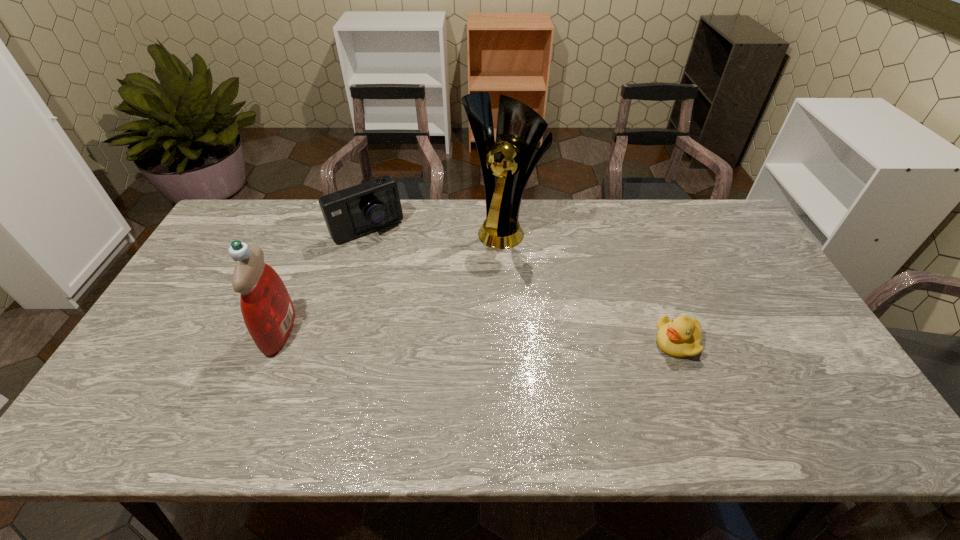
Image resolution: width=960 pixels, height=540 pixels. Identify the location of vacant point located between the third tallest object and the tallest object. (435, 229).

Locate an element on the screen. This screenshot has height=540, width=960. free space between the duckling and the second shortest object is located at coordinates (522, 286).

The width and height of the screenshot is (960, 540). Find the location of `free space between the duckling and the tallest object`. free space between the duckling and the tallest object is located at coordinates (589, 285).

Identify which object is located as the second nearest to the third tallest object. Please provide its 2D coordinates. Your answer should be formatted as a tuple, i.e. [(x, y)], where the tuple contains the x and y coordinates of a point satisfying the conditions above.

[(268, 312)]

Identify the location of the closest object to the shortest object. The width and height of the screenshot is (960, 540). (504, 164).

The width and height of the screenshot is (960, 540). I want to click on vacant position in the image that satisfies the following two spatial constraints: 1. on the front side of the camera; 2. on the front-facing side of the duckling, so click(335, 342).

Where is `free space that satisfies the following two spatial constraints: 1. on the front side of the shortest object; 2. on the front-facing side of the second object from right to left`? The image size is (960, 540). free space that satisfies the following two spatial constraints: 1. on the front side of the shortest object; 2. on the front-facing side of the second object from right to left is located at coordinates (509, 342).

Image resolution: width=960 pixels, height=540 pixels. Identify the location of vacant space that satisfies the following two spatial constraints: 1. on the front side of the tallest object; 2. on the front-facing side of the rightmost object. (509, 342).

Where is `vacant area in the image that satisfies the following two spatial constraints: 1. on the front side of the rightmost object; 2. on the front-facing side of the camera`? vacant area in the image that satisfies the following two spatial constraints: 1. on the front side of the rightmost object; 2. on the front-facing side of the camera is located at coordinates (335, 342).

Locate an element on the screen. Image resolution: width=960 pixels, height=540 pixels. blank space that satisfies the following two spatial constraints: 1. on the front side of the award; 2. on the front-facing side of the duckling is located at coordinates (509, 342).